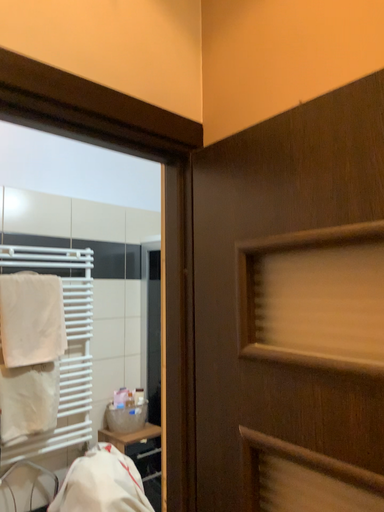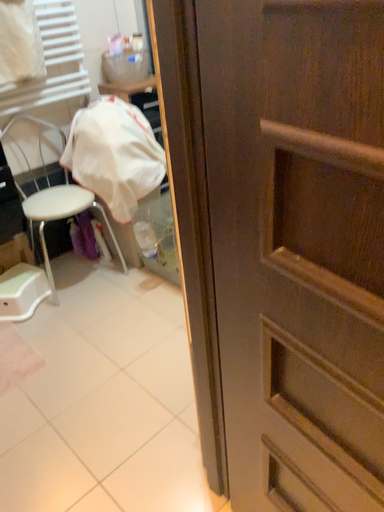
Question: Which way did the camera rotate in the video?

Choices:
 (A) rotated upward
 (B) rotated downward

Answer: (B)